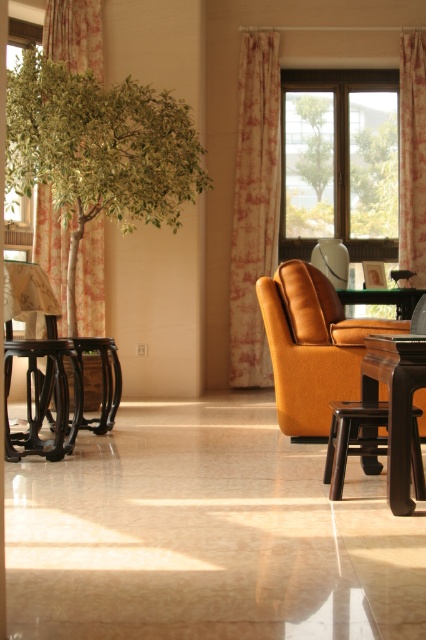
Does matte orange armchair at center appear on the left side of floral fabric curtain at upper right?

Correct, you'll find matte orange armchair at center to the left of floral fabric curtain at upper right.

Between matte orange armchair at center and floral fabric curtain at upper right, which one appears on the right side from the viewer's perspective?

Positioned to the right is floral fabric curtain at upper right.

I want to click on matte orange armchair at center, so click(x=313, y=346).

Can you confirm if dark brown wooden stool at lower right is shorter than transparent glass window at upper left?

Indeed, dark brown wooden stool at lower right has a lesser height compared to transparent glass window at upper left.

Does point (331, 465) come behind point (6, 200)?

No, (331, 465) is in front of (6, 200).

Which is in front, point (377, 420) or point (20, 202)?

Positioned in front is point (377, 420).

You are a GUI agent. You are given a task and a screenshot of the screen. Output one action in this format:
    pyautogui.click(x=<x>, y=<y>)
    Task: Click on the dark brown wooden stool at lower right
    
    Given the screenshot: What is the action you would take?
    pyautogui.click(x=351, y=438)

Does dark brown wooden table at lower right have a lesser width compared to floral fabric curtain at upper right?

Indeed, dark brown wooden table at lower right has a lesser width compared to floral fabric curtain at upper right.

Who is lower down, dark brown wooden table at lower right or floral fabric curtain at upper right?

Positioned lower is dark brown wooden table at lower right.

What do you see at coordinates (396, 403) in the screenshot? This screenshot has height=640, width=426. I see `dark brown wooden table at lower right` at bounding box center [396, 403].

This screenshot has width=426, height=640. I want to click on dark brown wooden table at lower right, so click(396, 403).